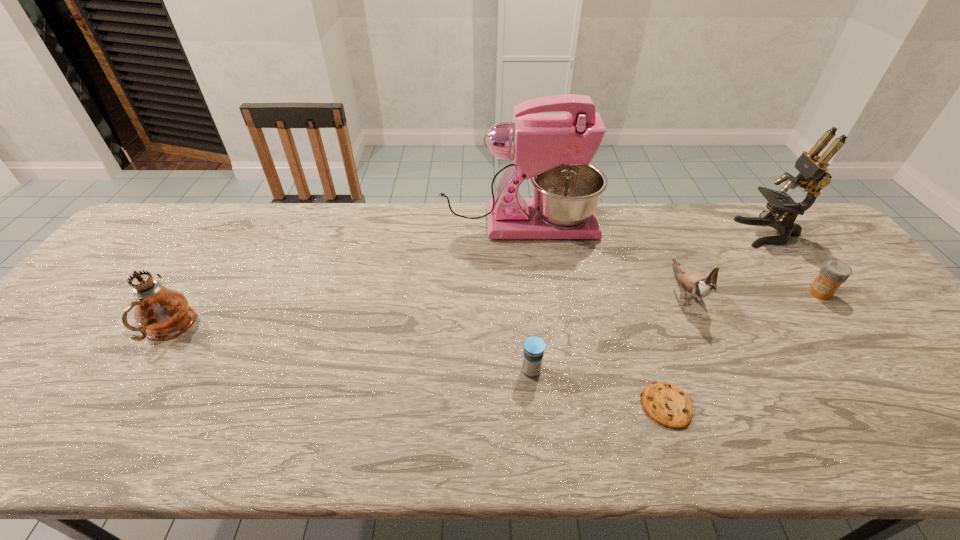
The width and height of the screenshot is (960, 540). What are the coordinates of `mixer` in the screenshot? It's located at (554, 150).

Locate an element on the screen. Image resolution: width=960 pixels, height=540 pixels. microscope is located at coordinates click(x=813, y=176).

At what (x,y) coordinates should I click in order to perform the action: click on the leftmost object. Please return your answer as a coordinate pair (x, y). Looking at the image, I should click on (161, 313).

This screenshot has height=540, width=960. I want to click on bird, so click(x=699, y=285).

At what (x,y) coordinates should I click in order to perform the action: click on the third object from right to left. Please return your answer as a coordinate pair (x, y). Image resolution: width=960 pixels, height=540 pixels. Looking at the image, I should click on (699, 285).

I want to click on the nearer medicine, so click(x=534, y=347).

Identify the location of the left medicine. The width and height of the screenshot is (960, 540). (534, 347).

Find the location of a particular element. the right medicine is located at coordinates (833, 273).

This screenshot has width=960, height=540. Identify the location of the nearest object. (668, 405).

Find the location of a particular element. Image resolution: width=960 pixels, height=540 pixels. the shortest object is located at coordinates (668, 405).